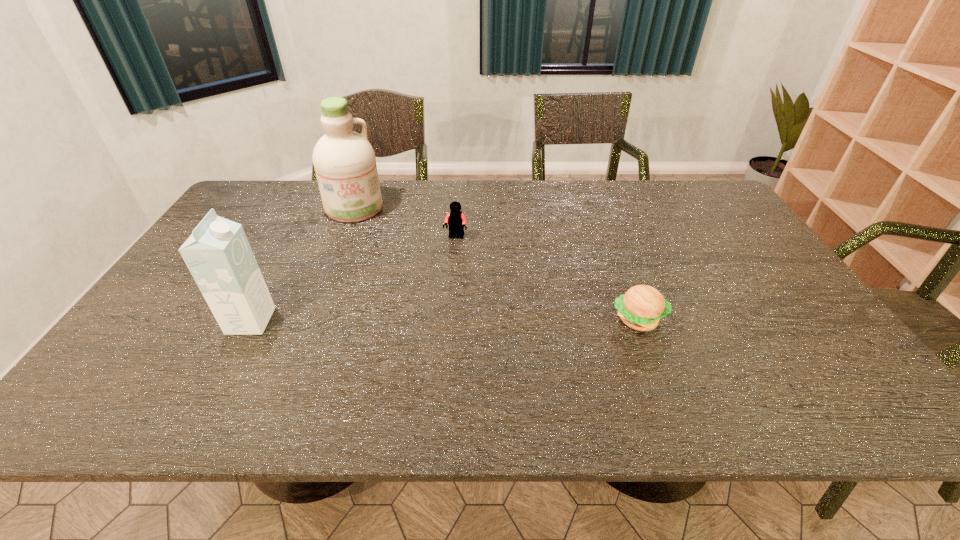
Find the location of a particular element. vacant space positioned 0.280m on the front label of the farthest object is located at coordinates (383, 274).

Find the location of `vacant space located 0.330m on the front label of the farthest object`. vacant space located 0.330m on the front label of the farthest object is located at coordinates (387, 285).

Locate an element on the screen. The width and height of the screenshot is (960, 540). vacant space situated 0.110m on the front label of the farthest object is located at coordinates (369, 241).

The image size is (960, 540). I want to click on free space located 0.360m on the front-facing side of the second object from right to left, so click(x=411, y=327).

This screenshot has width=960, height=540. I want to click on blank space located 0.130m on the front-facing side of the second object from right to left, so click(x=440, y=269).

Find the location of a particular element. vacant space located 0.390m on the front-facing side of the second object from right to left is located at coordinates (407, 336).

The image size is (960, 540). Identify the location of object that is at the far edge. (345, 165).

The width and height of the screenshot is (960, 540). Find the location of `vacant space at the far edge of the desktop`. vacant space at the far edge of the desktop is located at coordinates (597, 198).

Find the location of a particular element. Image resolution: width=960 pixels, height=540 pixels. vacant space at the near edge of the desktop is located at coordinates (245, 347).

Locate an element on the screen. The image size is (960, 540). free space at the left edge of the desktop is located at coordinates (207, 311).